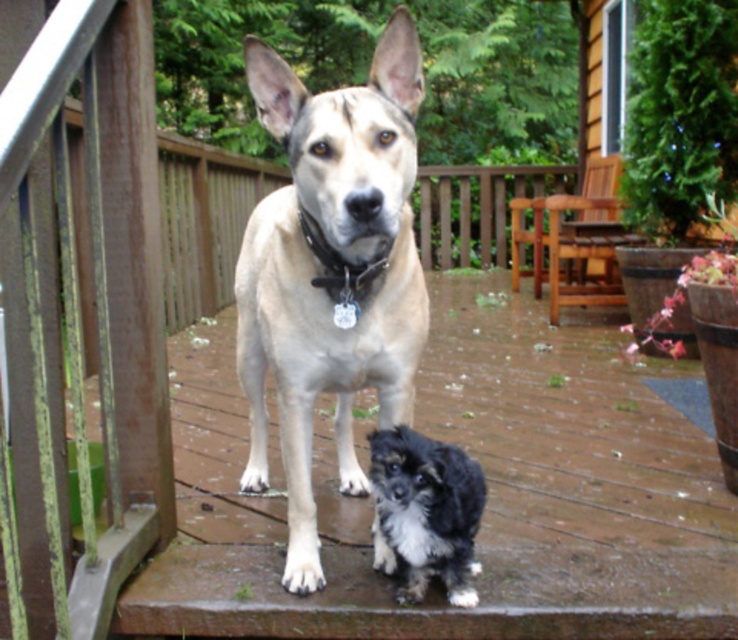
Locate an element on the screen. light brown fur dog at center is located at coordinates (331, 269).

Does light brown fur dog at center have a lesser width compared to black fuzzy dog at lower center?

No.

The image size is (738, 640). What do you see at coordinates (331, 269) in the screenshot?
I see `light brown fur dog at center` at bounding box center [331, 269].

Find the location of a particular element. The height and width of the screenshot is (640, 738). light brown fur dog at center is located at coordinates (331, 269).

Does black fuzzy dog at lower center appear under metallic chain at center?

Yes.

Does black fuzzy dog at lower center have a greater width compared to metallic chain at center?

Correct, the width of black fuzzy dog at lower center exceeds that of metallic chain at center.

Where is `black fuzzy dog at lower center`? This screenshot has height=640, width=738. black fuzzy dog at lower center is located at coordinates (427, 509).

In order to click on black fuzzy dog at lower center in this screenshot , I will do `click(427, 509)`.

Which is below, light brown fur dog at center or metallic chain at center?

light brown fur dog at center

You are a GUI agent. You are given a task and a screenshot of the screen. Output one action in this format:
    pyautogui.click(x=<x>, y=<y>)
    Task: Click on the light brown fur dog at center
    
    Given the screenshot: What is the action you would take?
    pyautogui.click(x=331, y=269)

The image size is (738, 640). Identify the location of light brown fur dog at center. (331, 269).